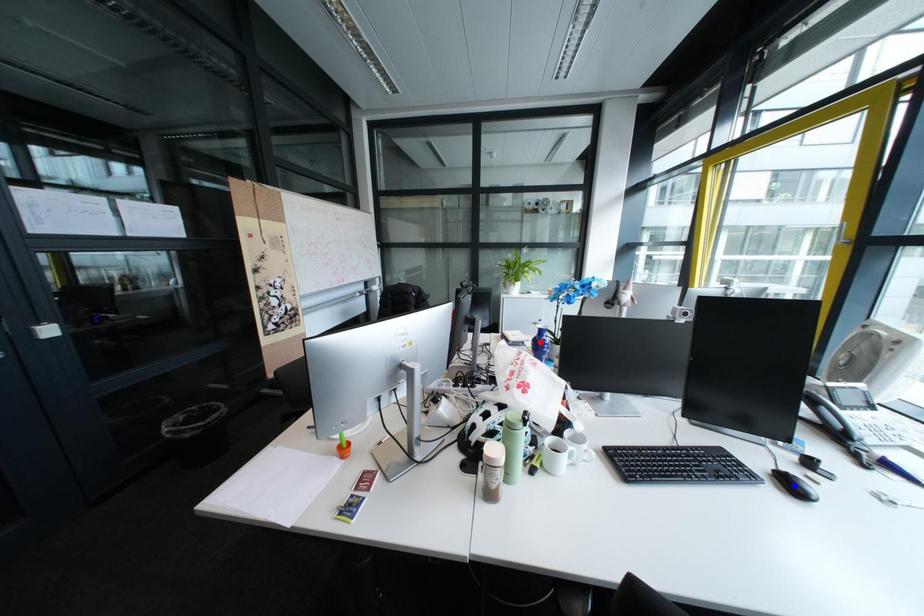
Question: In the image, two points are highlighted. Which point is nearer to the camera? Reply with the corresponding letter.

Choices:
 (A) blue point
 (B) red point

Answer: (A)